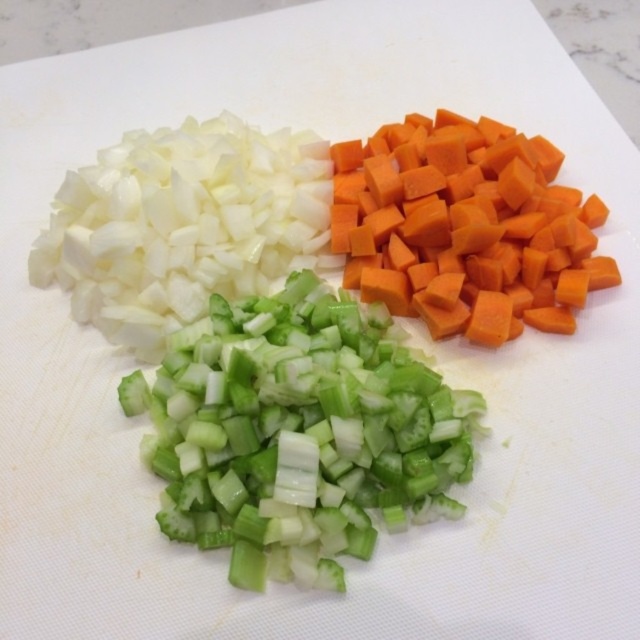
Who is shorter, white matte onion at upper left or orange matte carrot at upper right?

With less height is orange matte carrot at upper right.

Can you confirm if white matte onion at upper left is thinner than orange matte carrot at upper right?

No.

Between point (205, 218) and point (362, 154), which one is positioned behind?

Point (362, 154)

Identify the location of white matte onion at upper left. (182, 225).

Who is taller, green translucent celery at center or orange matte carrot at upper right?

Standing taller between the two is green translucent celery at center.

Between green translucent celery at center and orange matte carrot at upper right, which one is positioned higher?

Positioned higher is orange matte carrot at upper right.

Which is in front, point (196, 435) or point (356, 172)?

Positioned in front is point (196, 435).

Locate an element on the screen. The width and height of the screenshot is (640, 640). green translucent celery at center is located at coordinates (298, 433).

Which of these two, green translucent celery at center or white matte onion at upper left, stands taller?

Standing taller between the two is green translucent celery at center.

Does green translucent celery at center have a lesser width compared to white matte onion at upper left?

Incorrect, green translucent celery at center's width is not less than white matte onion at upper left's.

Is point (426, 385) farther from viewer compared to point (236, 176)?

No.

You are a GUI agent. You are given a task and a screenshot of the screen. Output one action in this format:
    pyautogui.click(x=<x>, y=<y>)
    Task: Click on the green translucent celery at center
    The width and height of the screenshot is (640, 640).
    Given the screenshot: What is the action you would take?
    pyautogui.click(x=298, y=433)